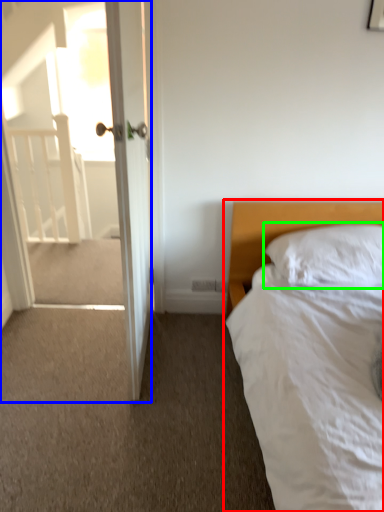
Question: Estimate the real-world distances between objects in this image. Which object is farther from bed (highlighted by a red box), screen door (highlighted by a blue box) or pillow (highlighted by a green box)?

Choices:
 (A) screen door
 (B) pillow

Answer: (A)